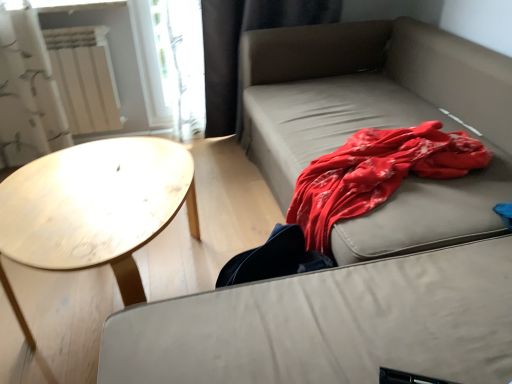
Question: Should I look upward or downward to see light wood/texture coffee table at left?

Choices:
 (A) down
 (B) up

Answer: (A)

Question: Is the depth of light wood/texture coffee table at left less than that of black fabric curtain at upper left?

Choices:
 (A) yes
 (B) no

Answer: (A)

Question: Is there a large distance between light wood/texture coffee table at left and black fabric curtain at upper left?

Choices:
 (A) yes
 (B) no

Answer: (A)

Question: Considering the relative positions of light wood/texture coffee table at left and black fabric curtain at upper left in the image provided, is light wood/texture coffee table at left behind black fabric curtain at upper left?

Choices:
 (A) yes
 (B) no

Answer: (B)

Question: Is light wood/texture coffee table at left positioned with its back to black fabric curtain at upper left?

Choices:
 (A) yes
 (B) no

Answer: (B)

Question: Does light wood/texture coffee table at left have a larger size compared to black fabric curtain at upper left?

Choices:
 (A) no
 (B) yes

Answer: (A)

Question: Considering the relative sizes of light wood/texture coffee table at left and black fabric curtain at upper left in the image provided, is light wood/texture coffee table at left wider than black fabric curtain at upper left?

Choices:
 (A) no
 (B) yes

Answer: (B)

Question: From the image's perspective, does matte beige studio couch at upper right appear higher than light wood/texture coffee table at left?

Choices:
 (A) no
 (B) yes

Answer: (B)

Question: Is matte beige studio couch at upper right further to the viewer compared to light wood/texture coffee table at left?

Choices:
 (A) yes
 (B) no

Answer: (B)

Question: Is matte beige studio couch at upper right to the right of light wood/texture coffee table at left from the viewer's perspective?

Choices:
 (A) no
 (B) yes

Answer: (B)

Question: Is matte beige studio couch at upper right thinner than light wood/texture coffee table at left?

Choices:
 (A) no
 (B) yes

Answer: (A)

Question: From a real-world perspective, is matte beige studio couch at upper right physically above light wood/texture coffee table at left?

Choices:
 (A) yes
 (B) no

Answer: (A)

Question: Is matte beige studio couch at upper right oriented away from light wood/texture coffee table at left?

Choices:
 (A) yes
 (B) no

Answer: (B)

Question: From a real-world perspective, is black fabric curtain at upper left on top of matte beige studio couch at upper right?

Choices:
 (A) yes
 (B) no

Answer: (A)